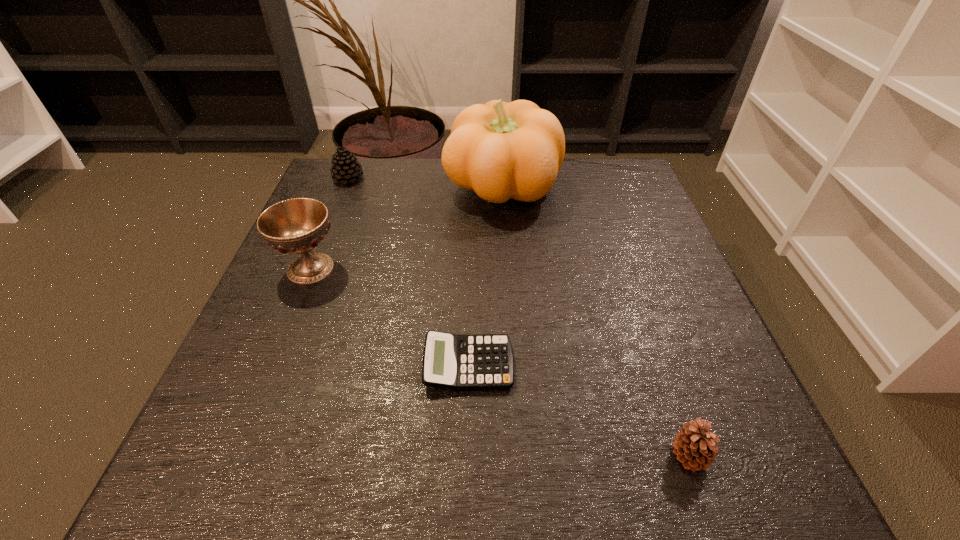
I want to click on vacant space that satisfies the following two spatial constraints: 1. on the front side of the shortest object; 2. on the left side of the fourth shortest object, so click(271, 365).